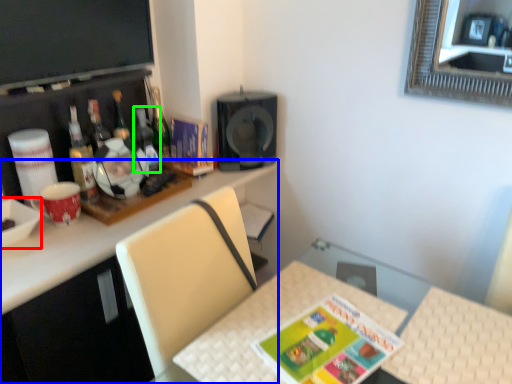
Question: Estimate the real-world distances between objects in this image. Which object is farther from bowl (highlighted by a red box), desk (highlighted by a blue box) or bottle (highlighted by a green box)?

Choices:
 (A) desk
 (B) bottle

Answer: (B)